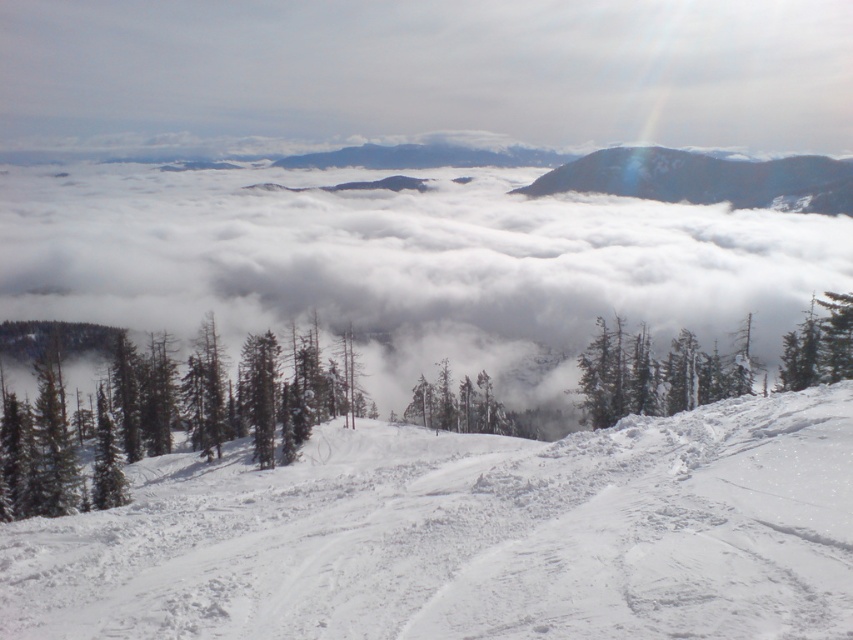
You are standing at the snow covered slope and want to reach the point that is closer to you. Which point should you head towards, point [651,323] or point [816,323]?

You should head towards point [651,323] because it is closer to you than point [816,323].

You are standing at the snow slope with tire tracks and want to reach a point marked by coordinates. Which of the two points, point (49,570) or point (840,308), is closer to you?

Point (49,570) is in front of point (840,308), so it is closer to you.